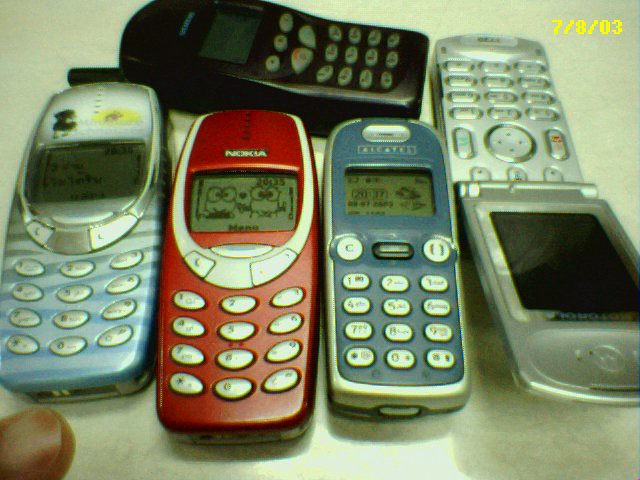
This screenshot has width=640, height=480. What are the coordinates of `phones` in the screenshot? It's located at (116, 198), (258, 237), (396, 257), (506, 150), (328, 74).